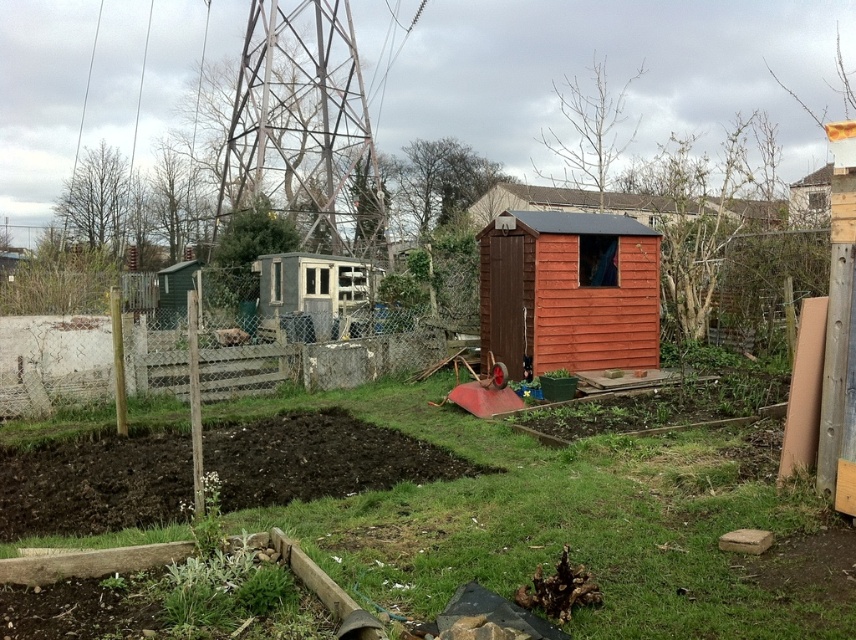
Question: Based on their relative distances, which object is nearer to the orange wood shed at center?

Choices:
 (A) wooden fence at center
 (B) rusty metal shed at center

Answer: (A)

Question: Can you confirm if orange wood shed at center is thinner than rusty metal shed at center?

Choices:
 (A) no
 (B) yes

Answer: (B)

Question: Can you confirm if wooden fence at center is positioned above rusty metal shed at center?

Choices:
 (A) no
 (B) yes

Answer: (A)

Question: Among these objects, which one is nearest to the camera?

Choices:
 (A) rusty metal shed at center
 (B) wooden fence at center
 (C) orange wood shed at center

Answer: (C)

Question: Among these objects, which one is farthest from the camera?

Choices:
 (A) orange wood shed at center
 (B) wooden fence at center
 (C) rusty metal shed at center

Answer: (C)

Question: Can you confirm if orange wood shed at center is positioned to the right of rusty metal shed at center?

Choices:
 (A) no
 (B) yes

Answer: (B)